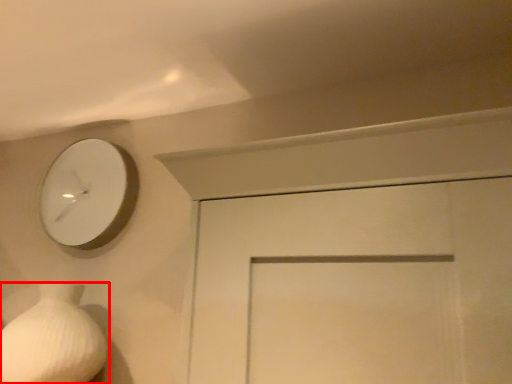
Question: From the image, what is the correct spatial relationship of vase (annotated by the red box) in relation to wall clock?

Choices:
 (A) left
 (B) right

Answer: (A)